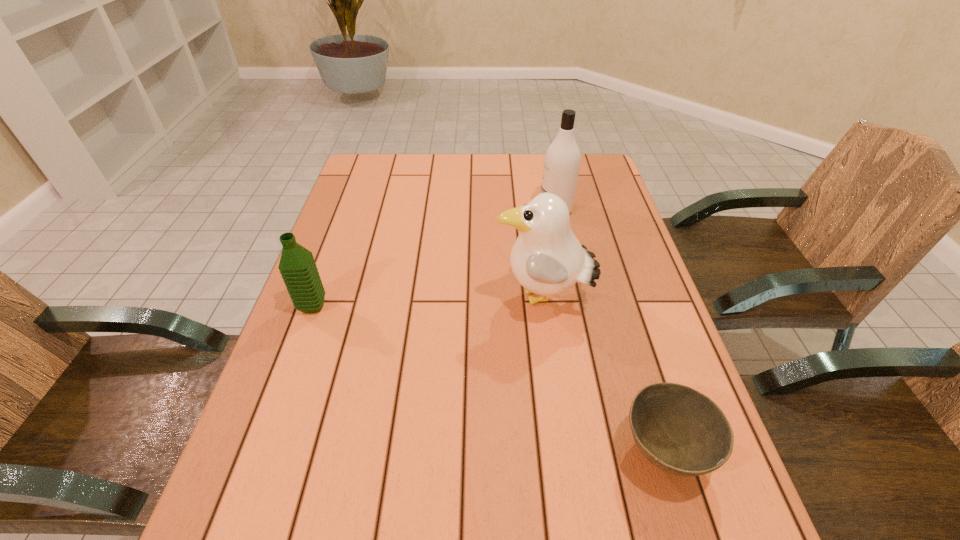
Find the location of a particular element. Image resolution: width=960 pixels, height=540 pixels. the farthest object is located at coordinates (562, 159).

I want to click on gull, so click(x=547, y=259).

Locate an element on the screen. The width and height of the screenshot is (960, 540). water bottle is located at coordinates (297, 266).

Locate an element on the screen. This screenshot has height=540, width=960. the leftmost object is located at coordinates (297, 266).

Identify the location of bowl. This screenshot has width=960, height=540. (x=678, y=429).

Where is `the nearest object`? the nearest object is located at coordinates (678, 429).

Locate an element on the screen. free region located on the front-facing side of the farthest object is located at coordinates (522, 210).

Where is `vacant space located 0.370m on the front-facing side of the farthest object`? vacant space located 0.370m on the front-facing side of the farthest object is located at coordinates (415, 210).

Identify the location of vacant position located on the front-facing side of the farthest object. (502, 210).

The height and width of the screenshot is (540, 960). What are the coordinates of `free space located 0.060m on the beak of the gull` in the screenshot? It's located at (468, 299).